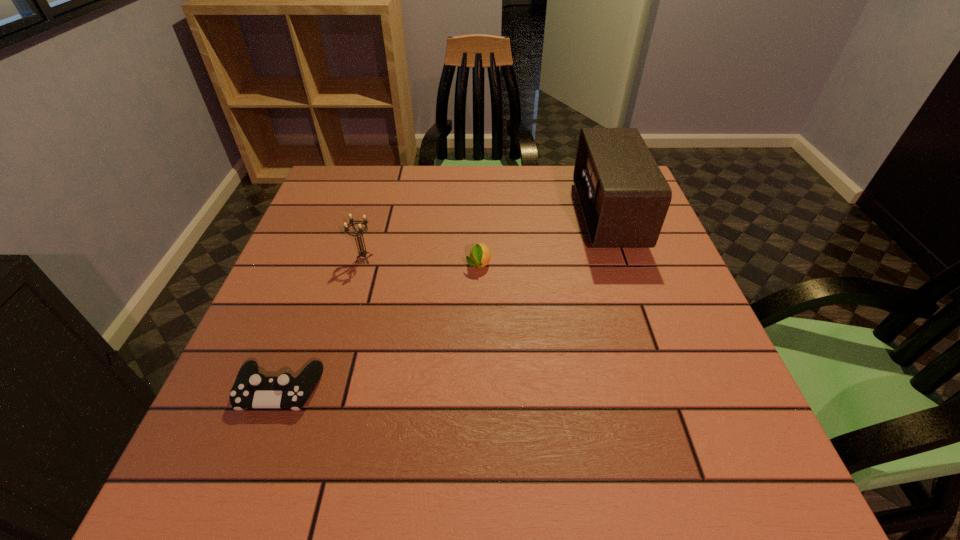
Locate an element on the screen. vacant space located 0.110m on the surface of the nearest object is located at coordinates (246, 481).

Image resolution: width=960 pixels, height=540 pixels. Identify the location of object present at the far edge. click(x=624, y=197).

Image resolution: width=960 pixels, height=540 pixels. I want to click on candle holder that is at the left edge, so click(362, 253).

At what (x,y) coordinates should I click in order to perform the action: click on control positioned at the left edge. Please return your answer as a coordinate pair (x, y). Image resolution: width=960 pixels, height=540 pixels. Looking at the image, I should click on (251, 389).

Where is `object that is at the right edge`? This screenshot has height=540, width=960. object that is at the right edge is located at coordinates (624, 197).

At what (x,y) coordinates should I click in order to perform the action: click on object that is positioned at the far right corner. Please return your answer as a coordinate pair (x, y). The width and height of the screenshot is (960, 540). Looking at the image, I should click on (624, 197).

The width and height of the screenshot is (960, 540). Find the location of `vacant region at the far edge of the desktop`. vacant region at the far edge of the desktop is located at coordinates (392, 195).

The height and width of the screenshot is (540, 960). Find the location of `free space at the near edge of the desktop`. free space at the near edge of the desktop is located at coordinates (465, 473).

What are the coordinates of `free space at the left edge of the desktop` in the screenshot? It's located at (264, 302).

Locate an element on the screen. vacant region at the right edge of the desktop is located at coordinates (643, 305).